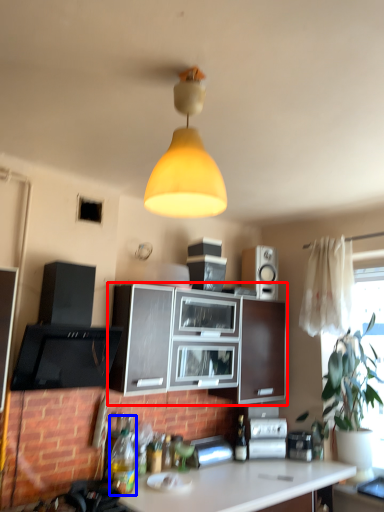
Question: Which point is closer to the camera, cabinetry (highlighted by a red box) or bottle (highlighted by a blue box)?

Choices:
 (A) cabinetry
 (B) bottle

Answer: (B)